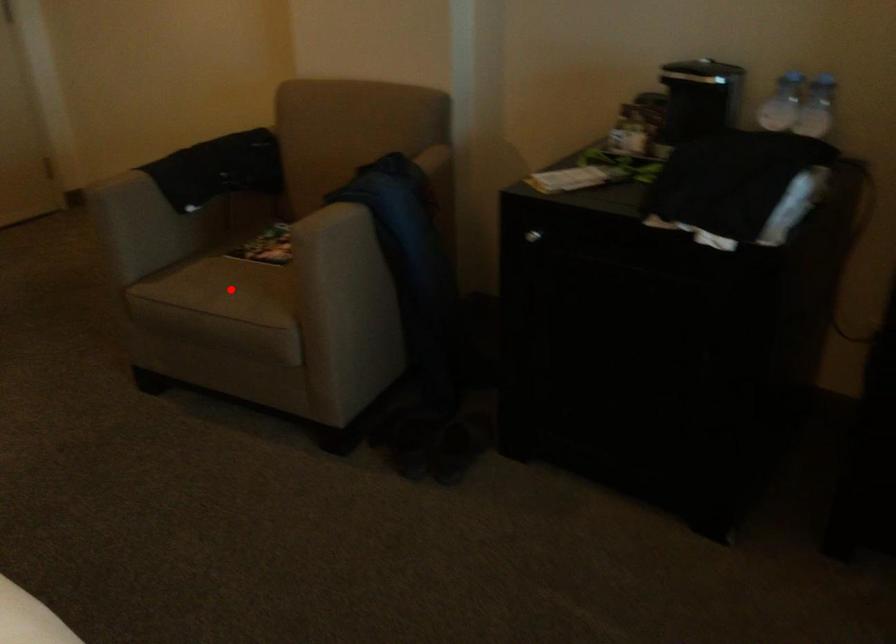
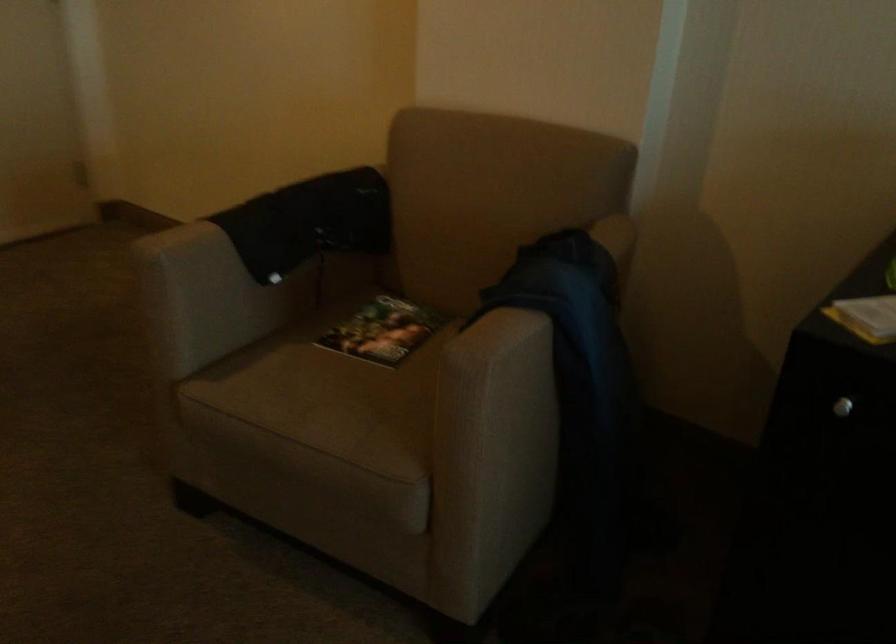
Question: I am providing you with two images of the same scene from different viewpoints. Image1 has a red point marked. In image2, the corresponding 3D location appears at what relative position? Reply with the corresponding letter.

Choices:
 (A) Closer
 (B) Farther

Answer: (A)